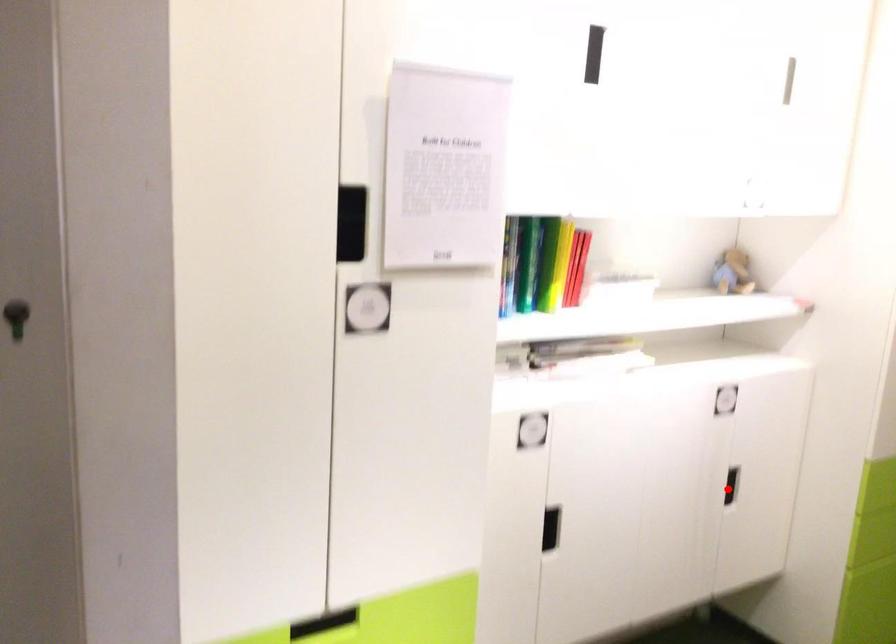
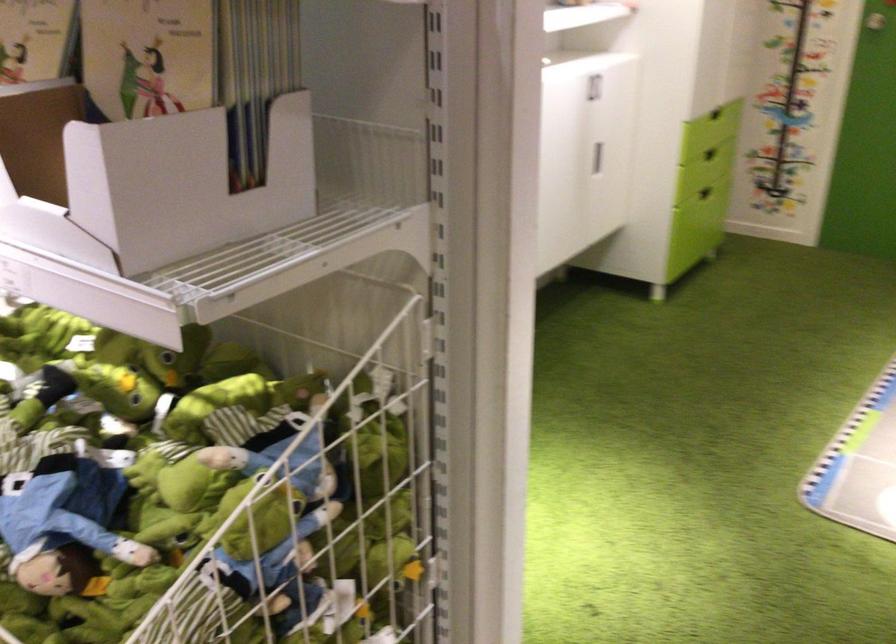
Where in the second image is the point corresponding to the highlighted location from the first image?

(597, 158)